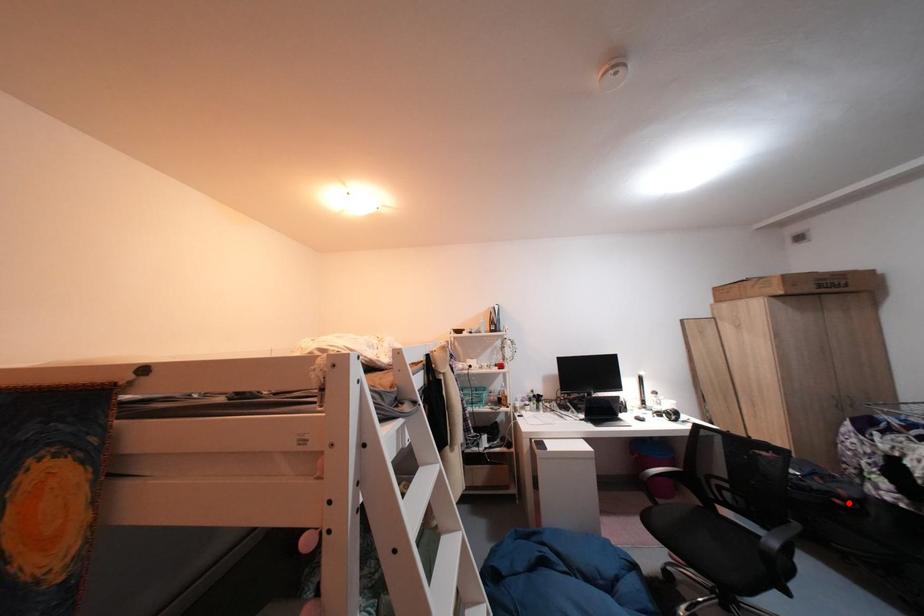
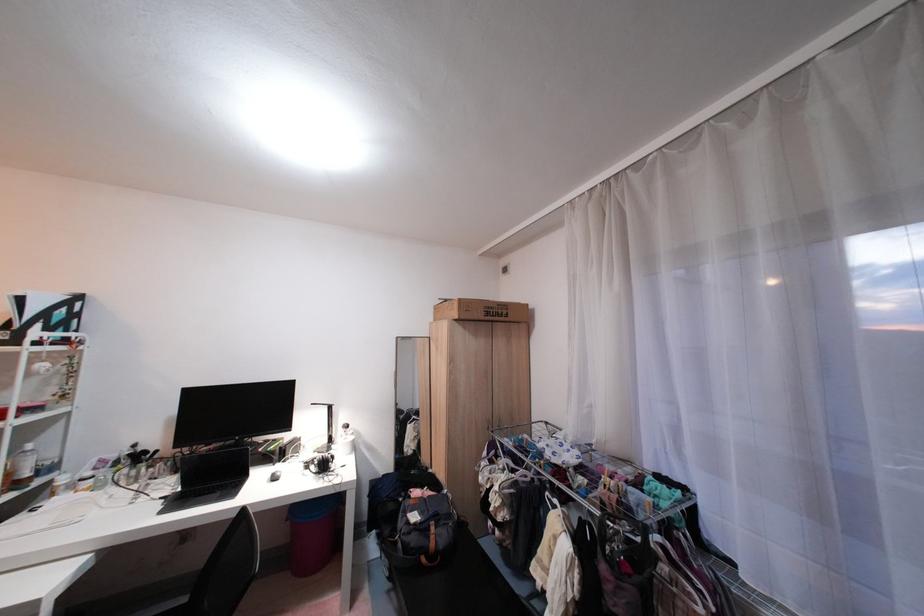
Question: I am providing you with two images of the same scene from different viewpoints. Given a red point in image1, look at the same physical point in image2. Is it:

Choices:
 (A) Closer to the viewpoint
 (B) Farther from the viewpoint

Answer: (B)